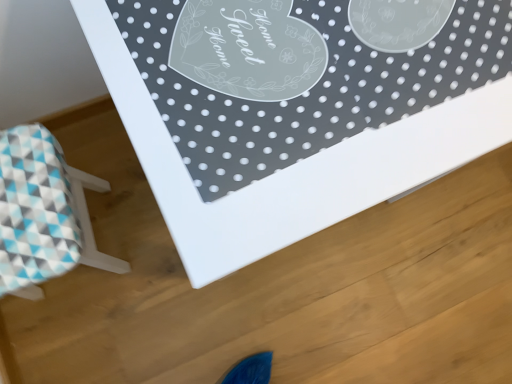
Locate an element on the screen. Image resolution: width=512 pixels, height=384 pixels. free space in front of white glossy table at upper center is located at coordinates (236, 318).